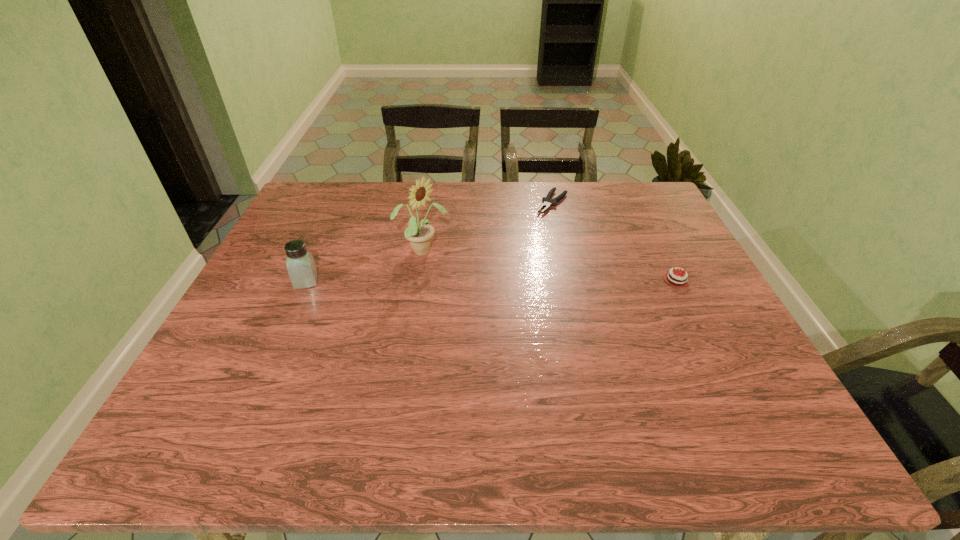
Image resolution: width=960 pixels, height=540 pixels. Identify the location of free spot that satisfies the following two spatial constraints: 1. on the back side of the third tallest object; 2. on the right side of the saltshaker. (306, 280).

Where is `vacant point that satisfies the following two spatial constraints: 1. on the back side of the second shortest object; 2. on the left side of the leftmost object`? vacant point that satisfies the following two spatial constraints: 1. on the back side of the second shortest object; 2. on the left side of the leftmost object is located at coordinates (306, 280).